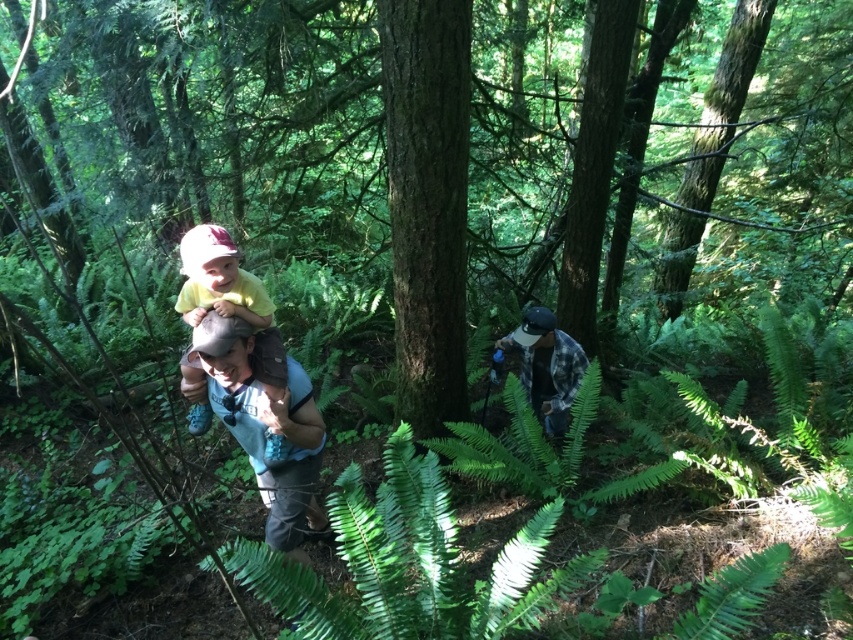
You are a photographer trying to capture a closeup of the yellow matte shirt at center and the flannel shirt at center in the forest scene. Since the camera can only focus on one object at a time, which shirt should you choose to ensure the larger one is in focus?

The yellow matte shirt at center is larger in size than the flannel shirt at center, so you should focus on the yellow matte shirt at center to ensure the larger one is in focus.

You are a hiker trying to navigate through the forest. You see the green leafy fern at center and the yellow matte shirt at center. Which object is taller?

The yellow matte shirt at center is taller than the green leafy fern at center.

You are a photographer positioned in the forest scene. You want to take a photo that includes both the yellow matte shirt at center and the flannel shirt at center. Which of these shirts will appear larger in your photo?

The yellow matte shirt at center will appear larger in the photo because it is closer to the viewer than the flannel shirt at center.